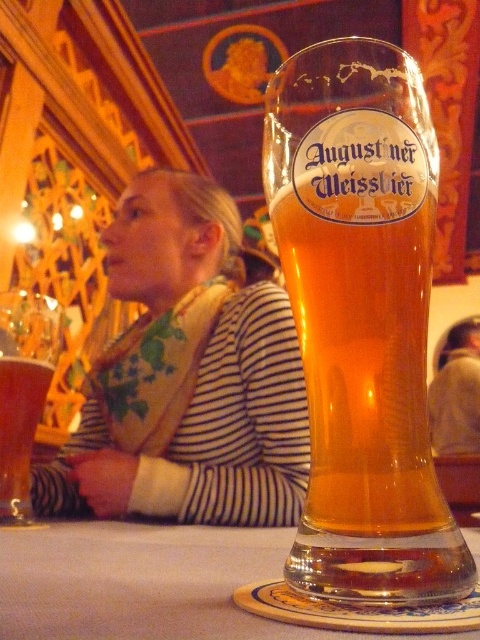
Question: Can you confirm if translucent glass beer glass at center is positioned to the left of white cloth table at center?

Choices:
 (A) yes
 (B) no

Answer: (B)

Question: Does translucent glass beer glass at center appear on the left side of striped fabric scarf at upper left?

Choices:
 (A) no
 (B) yes

Answer: (A)

Question: Which of these objects is positioned closest to the white cloth table at center?

Choices:
 (A) striped fabric scarf at upper left
 (B) translucent glass mug at left

Answer: (B)

Question: Which object is positioned farthest from the translucent glass mug at left?

Choices:
 (A) striped fabric scarf at upper left
 (B) white cloth table at center

Answer: (A)

Question: Which point appears farthest from the camera in this image?

Choices:
 (A) (170, 448)
 (B) (312, 100)
 (C) (19, 352)

Answer: (A)

Question: Can you confirm if translucent glass beer glass at center is bigger than translucent glass mug at left?

Choices:
 (A) yes
 (B) no

Answer: (A)